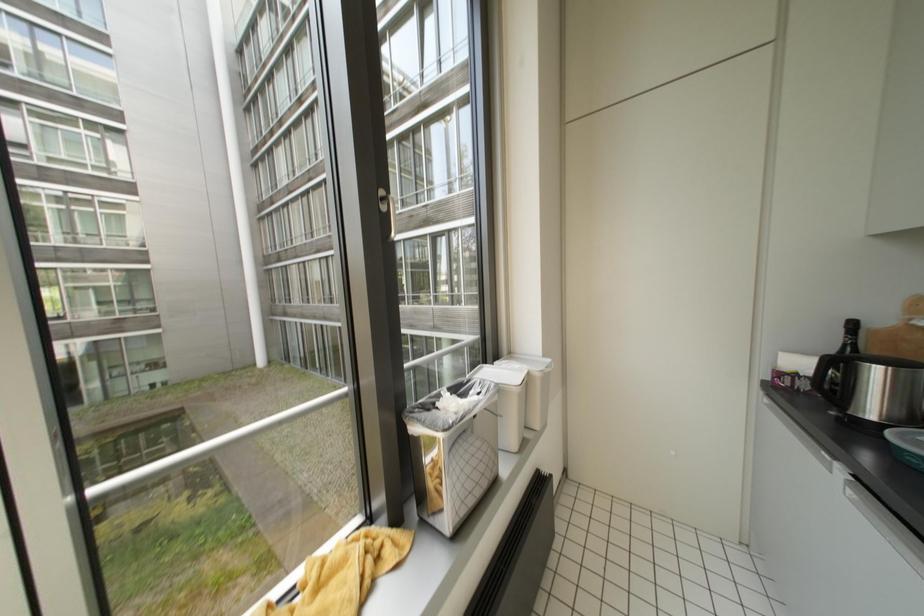
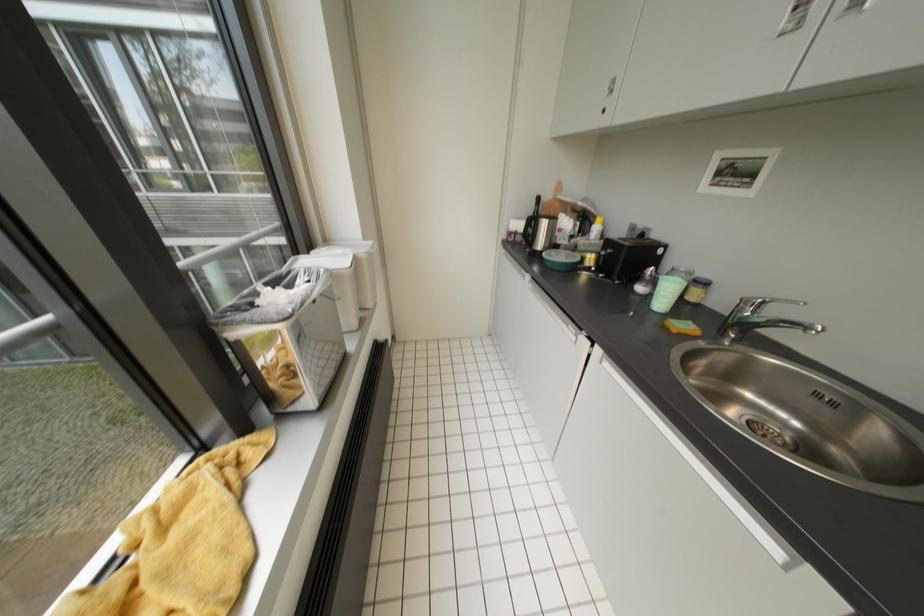
Based on the continuous images, in which direction is the camera rotating?

The rotation direction of the camera is right-down.